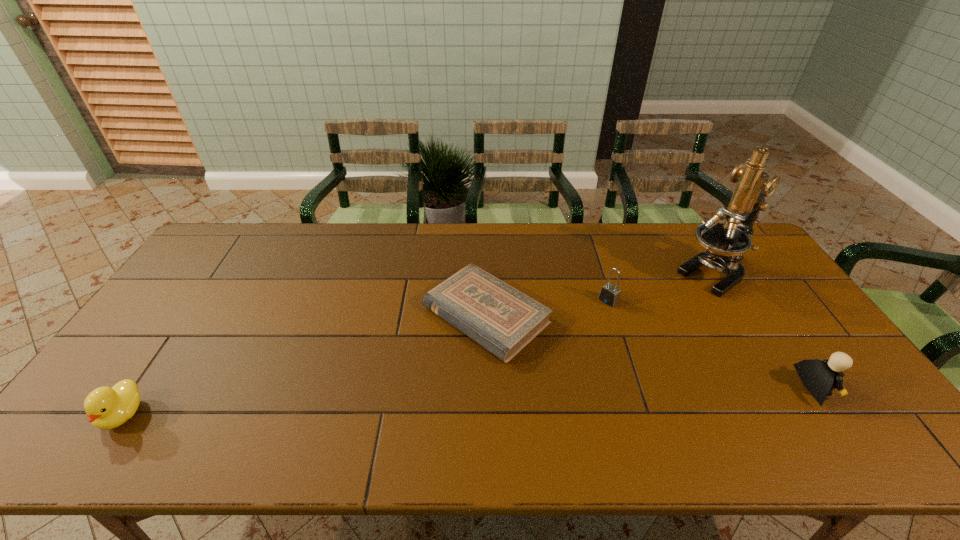
Find the location of a particular element. This screenshot has width=960, height=540. Lego present at the right edge is located at coordinates (819, 377).

In order to click on microscope located in the right edge section of the desktop in this screenshot , I will do `click(725, 243)`.

This screenshot has width=960, height=540. Find the location of `object at the near left corner`. object at the near left corner is located at coordinates (106, 408).

The height and width of the screenshot is (540, 960). What are the coordinates of `object located in the far right corner section of the desktop` in the screenshot? It's located at (725, 243).

Locate an element on the screen. The height and width of the screenshot is (540, 960). object present at the near right corner is located at coordinates (819, 377).

You are a GUI agent. You are given a task and a screenshot of the screen. Output one action in this format:
    pyautogui.click(x=<x>, y=<y>)
    Task: Click on the vacant space at the far edge
    
    Given the screenshot: What is the action you would take?
    pyautogui.click(x=252, y=264)

Find the location of a particular element. This screenshot has height=540, width=960. free space at the near edge is located at coordinates (327, 387).

Identify the location of free space at the left edge of the desktop. pos(157,344).

This screenshot has width=960, height=540. In the image, there is a desktop. What are the coordinates of `vacant space at the right edge` in the screenshot? It's located at (761, 331).

This screenshot has height=540, width=960. I want to click on free space at the far left corner of the desktop, so click(247, 226).